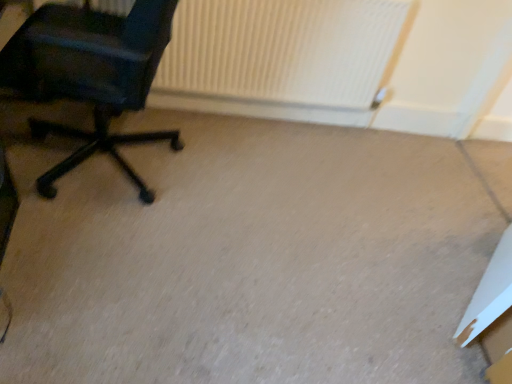
Question: Which is correct: white ribbed radiator at upper center is inside matte black office chair at left, or outside of it?

Choices:
 (A) outside
 (B) inside

Answer: (A)

Question: Is white ribbed radiator at upper center to the left or to the right of matte black office chair at left in the image?

Choices:
 (A) right
 (B) left

Answer: (A)

Question: Estimate the real-world distances between objects in this image. Which object is closer to the white cardboard box at lower right?

Choices:
 (A) white ribbed radiator at upper center
 (B) beige carpet at center
 (C) matte black office chair at left

Answer: (B)

Question: Which object is positioned farthest from the matte black office chair at left?

Choices:
 (A) beige carpet at center
 (B) white cardboard box at lower right
 (C) white ribbed radiator at upper center

Answer: (B)